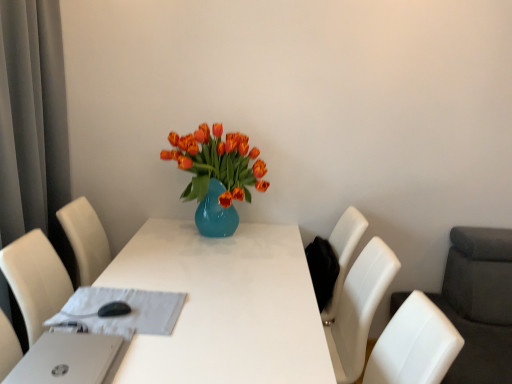
The image size is (512, 384). What are the coordinates of `vacant area to the right of white fabric at center` in the screenshot? It's located at (218, 319).